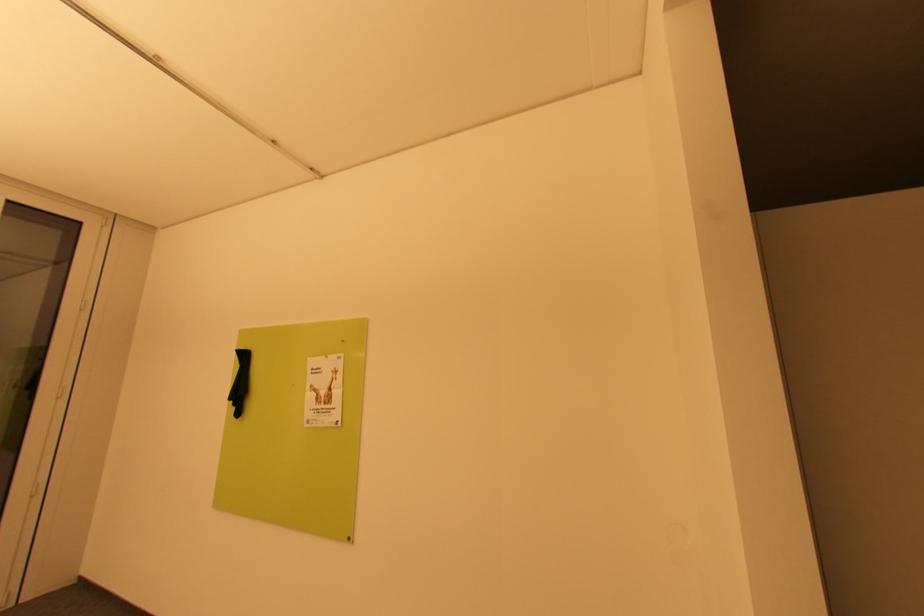
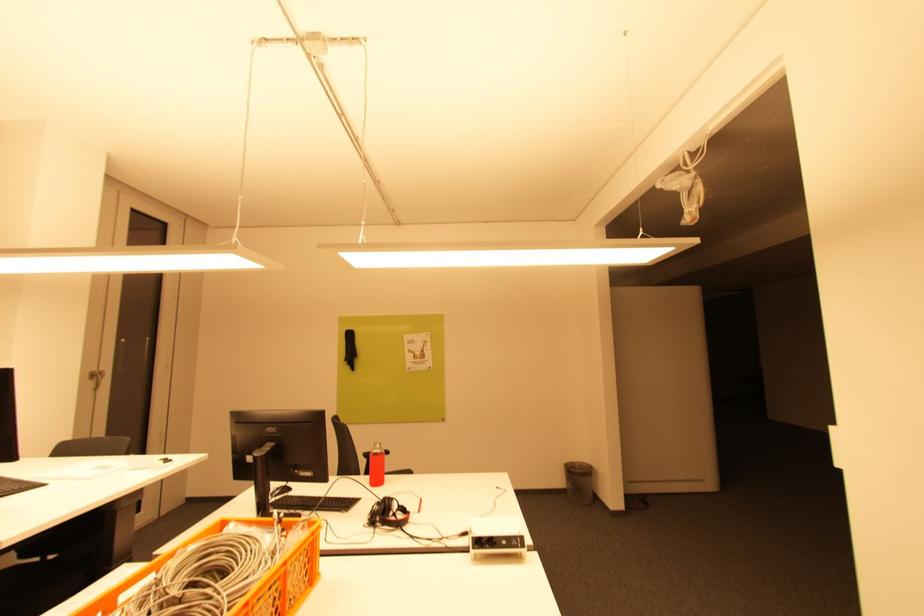
The images are taken continuously from a first-person perspective. In which direction are you moving?

The cameraman walked toward left, backward.